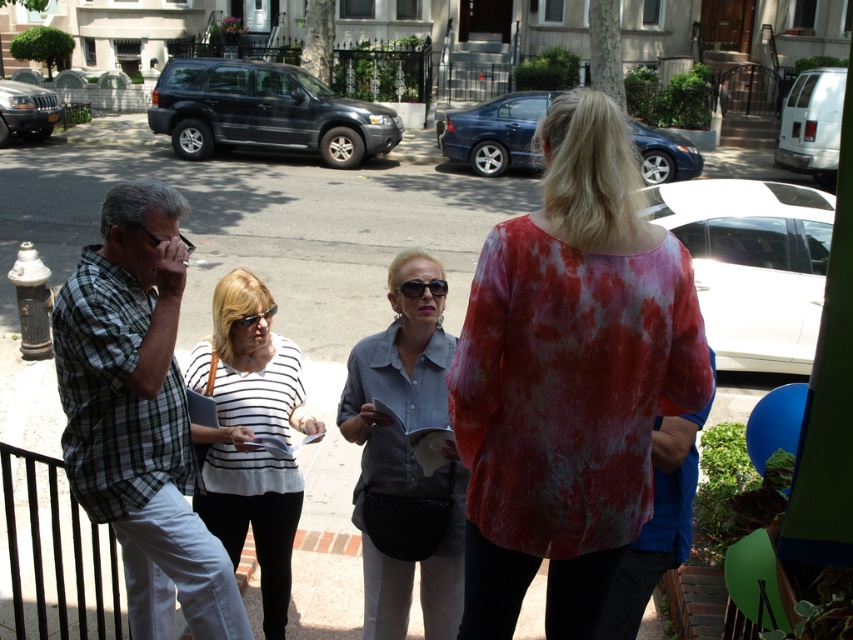
Question: Which object is the closest to the plaid cotton shirt at left?

Choices:
 (A) matte gray shirt at center
 (B) white striped shirt at center

Answer: (B)

Question: Does red tie-dye blouse at center lie behind matte gray shirt at center?

Choices:
 (A) yes
 (B) no

Answer: (B)

Question: In this image, where is red tie-dye blouse at center located relative to matte gray shirt at center?

Choices:
 (A) left
 (B) right

Answer: (B)

Question: Is the position of plaid cotton shirt at left less distant than that of matte gray shirt at center?

Choices:
 (A) no
 (B) yes

Answer: (B)

Question: Which of the following is the closest to the observer?

Choices:
 (A) (186, 582)
 (B) (410, 346)

Answer: (A)

Question: Which of the following is the closest to the observer?

Choices:
 (A) (233, 332)
 (B) (572, 532)
 (C) (357, 355)
 (D) (161, 438)

Answer: (B)